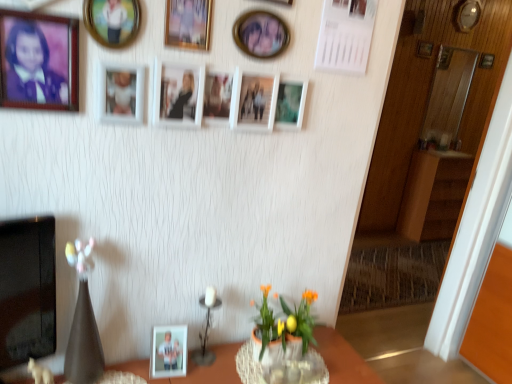
Question: Which direction should I rotate to look at matte white photo frame at lower center, which is counted as the 4th picture frame, starting from the left?

Choices:
 (A) left
 (B) right

Answer: (A)

Question: Considering the relative sizes of white matte picture frame at center, placed as the sixth picture frame when sorted from back to front, and wooden picture frame at upper right, acting as the third picture frame starting from the back, in the image provided, is white matte picture frame at center, placed as the sixth picture frame when sorted from back to front, bigger than wooden picture frame at upper right, acting as the third picture frame starting from the back,?

Choices:
 (A) no
 (B) yes

Answer: (B)

Question: Does white matte picture frame at center, the 8th picture frame when ordered from front to back, have a greater width compared to wooden picture frame at upper right, acting as the third picture frame starting from the back?

Choices:
 (A) yes
 (B) no

Answer: (A)

Question: Does white matte picture frame at center, which is the 8th picture frame from left to right, appear on the right side of wooden picture frame at upper right, the 11th picture frame in the front-to-back sequence?

Choices:
 (A) yes
 (B) no

Answer: (B)

Question: From a real-world perspective, is white matte picture frame at center, arranged as the 4th picture frame when ordered from the bottom, on top of wooden picture frame at upper right, which is the 3th picture frame in right-to-left order?

Choices:
 (A) no
 (B) yes

Answer: (A)

Question: Can you confirm if white matte picture frame at center, the 8th picture frame when ordered from front to back, is thinner than wooden picture frame at upper right, positioned as the 11th picture frame in left-to-right order?

Choices:
 (A) yes
 (B) no

Answer: (B)

Question: Is white matte picture frame at center, the 10th picture frame positioned from the top, not inside wooden picture frame at upper right, which is the 3th picture frame in right-to-left order?

Choices:
 (A) yes
 (B) no

Answer: (A)

Question: Are matte white photo frame at center, marked as the 5th picture frame in a front-to-back arrangement, and white matte picture frame at center, the 10th picture frame positioned from the top, making contact?

Choices:
 (A) yes
 (B) no

Answer: (B)

Question: From a real-world perspective, is matte white photo frame at center, which ranks as the eleventh picture frame in top-to-bottom order, located higher than white matte picture frame at center, placed as the sixth picture frame when sorted from back to front?

Choices:
 (A) yes
 (B) no

Answer: (B)

Question: Is matte white photo frame at center, marked as the ninth picture frame in a back-to-front arrangement, taller than white matte picture frame at center, arranged as the 4th picture frame when ordered from the bottom?

Choices:
 (A) yes
 (B) no

Answer: (B)

Question: Can you confirm if matte white photo frame at center, which ranks as the eleventh picture frame in top-to-bottom order, is smaller than white matte picture frame at center, the 10th picture frame positioned from the top?

Choices:
 (A) yes
 (B) no

Answer: (A)

Question: Is matte white photo frame at center, which ranks as the eleventh picture frame in top-to-bottom order, positioned before white matte picture frame at center, the 8th picture frame when ordered from front to back?

Choices:
 (A) no
 (B) yes

Answer: (B)

Question: From the image's perspective, would you say matte white photo frame at center, the ninth picture frame from the right, is positioned over white matte picture frame at center, the 8th picture frame when ordered from front to back?

Choices:
 (A) yes
 (B) no

Answer: (B)

Question: Could white matte picture frame at center, placed as the sixth picture frame when sorted from back to front, be considered to be inside wooden picture frame at upper right, which ranks as the first picture frame in right-to-left order?

Choices:
 (A) no
 (B) yes

Answer: (A)